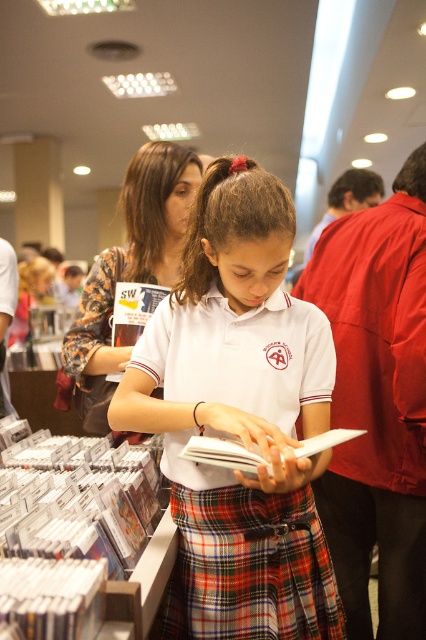
Question: Among these objects, which one is farthest from the camera?

Choices:
 (A) white matte book at center
 (B) matte floral dress at center
 (C) plaid fabric kilt at center
 (D) white cotton shirt at center

Answer: (B)

Question: Which point is closer to the camera?

Choices:
 (A) matte floral dress at center
 (B) white matte book at center
 (C) plaid fabric kilt at center

Answer: (B)

Question: Is white cotton shirt at center closer to the viewer compared to matte floral dress at center?

Choices:
 (A) yes
 (B) no

Answer: (A)

Question: Is white cotton shirt at center smaller than white matte book at center?

Choices:
 (A) no
 (B) yes

Answer: (A)

Question: Is matte floral dress at center above white matte book at center?

Choices:
 (A) no
 (B) yes

Answer: (B)

Question: Which object appears closest to the camera in this image?

Choices:
 (A) white cotton shirt at center
 (B) white matte book at center
 (C) plaid fabric kilt at center
 (D) matte floral dress at center

Answer: (B)